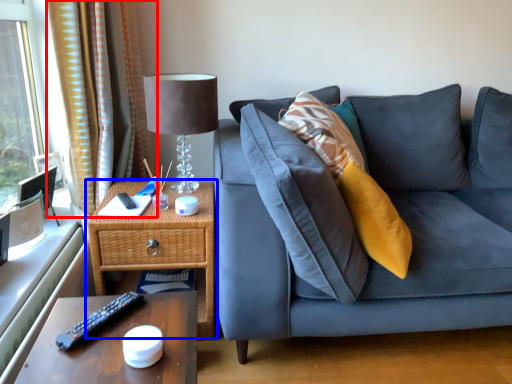
Question: Which point is further to the camera, curtain (highlighted by a red box) or nightstand (highlighted by a blue box)?

Choices:
 (A) curtain
 (B) nightstand

Answer: (A)